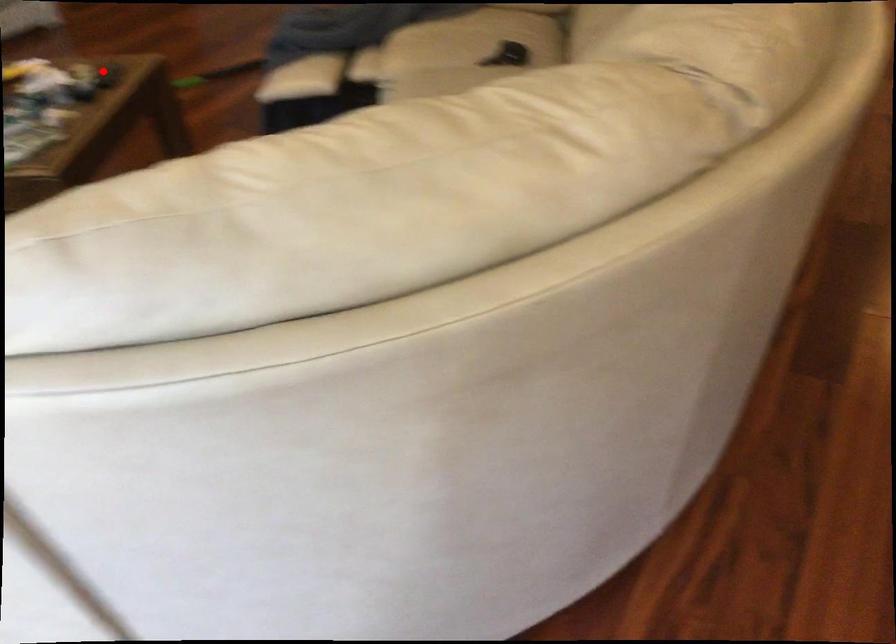
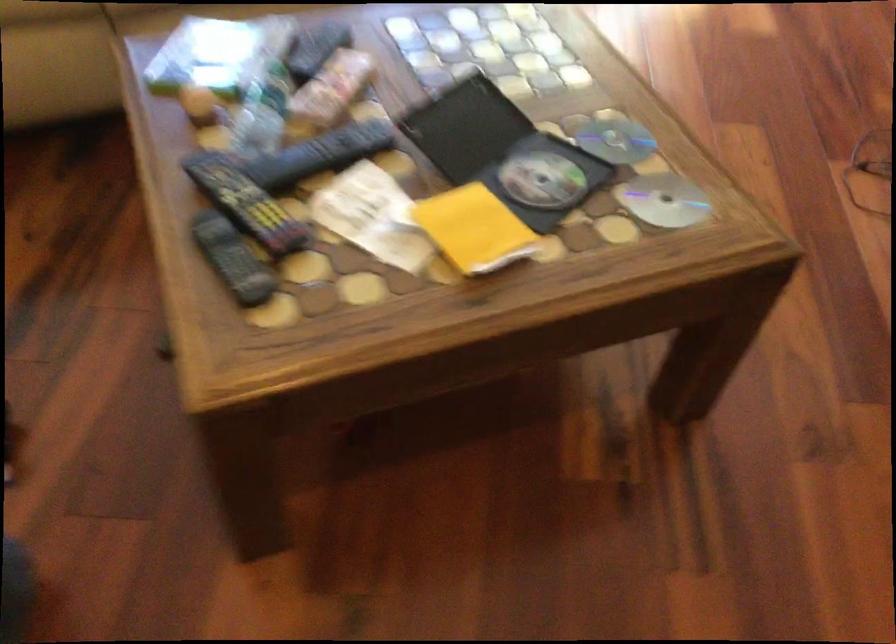
In the second image, find the point that corresponds to the highlighted location in the first image.

(233, 259)